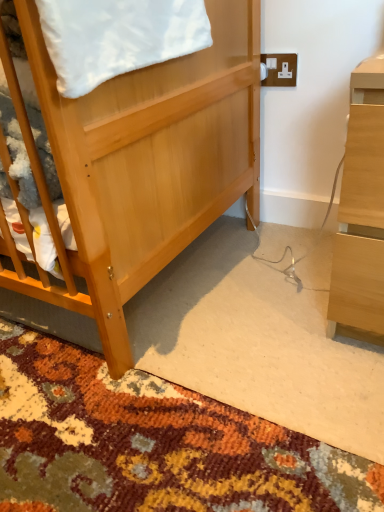
The height and width of the screenshot is (512, 384). I want to click on light brown wooden bed at center, so (x=141, y=164).

At what (x,y) coordinates should I click in order to perform the action: click on carpeted rug at center. Please return your answer as a coordinate pair (x, y). Looking at the image, I should click on (152, 443).

Which object is positioned more to the left, white plastic electric outlet at upper right or light brown wooden bed at center?

light brown wooden bed at center.

Is white plastic electric outlet at upper right wider than light brown wooden bed at center?

No, white plastic electric outlet at upper right is not wider than light brown wooden bed at center.

Can you confirm if white plastic electric outlet at upper right is bigger than light brown wooden bed at center?

Actually, white plastic electric outlet at upper right might be smaller than light brown wooden bed at center.

From a real-world perspective, between white plastic electric outlet at upper right and light brown wooden bed at center, who is vertically higher?

In real-world perspective, white plastic electric outlet at upper right is above.

Does light wood desk at right lie in front of white plastic electric outlet at upper right?

Yes.

Between light wood desk at right and white plastic electric outlet at upper right, which one appears on the left side from the viewer's perspective?

white plastic electric outlet at upper right.

How different are the orientations of light wood desk at right and white plastic electric outlet at upper right in degrees?

The angular difference between light wood desk at right and white plastic electric outlet at upper right is 0.00301 degrees.

Considering the positions of points (351, 281) and (290, 57), is point (351, 281) closer to camera compared to point (290, 57)?

Yes, point (351, 281) is closer to viewer.

Between light brown wooden bed at center and white soft blanket at upper left, which one has larger width?

light brown wooden bed at center is wider.

Is light brown wooden bed at center oriented away from white soft blanket at upper left?

light brown wooden bed at center is not turned away from white soft blanket at upper left.

Is light brown wooden bed at center positioned before white soft blanket at upper left?

Result: No, light brown wooden bed at center is behind white soft blanket at upper left.

Can we say light brown wooden bed at center lies outside white soft blanket at upper left?

That's correct, light brown wooden bed at center is outside of white soft blanket at upper left.

Is there a large distance between light wood desk at right and carpeted rug at center?

No.

Is light wood desk at right taller than carpeted rug at center?

Indeed, light wood desk at right has a greater height compared to carpeted rug at center.

In the scene shown: Considering the relative positions of light wood desk at right and carpeted rug at center in the image provided, is light wood desk at right to the left of carpeted rug at center from the viewer's perspective?

No, light wood desk at right is not to the left of carpeted rug at center.

Which of these two, white plastic electric outlet at upper right or white soft blanket at upper left, stands taller?

white soft blanket at upper left is taller.

From the image's perspective, between white plastic electric outlet at upper right and white soft blanket at upper left, who is located below?

white soft blanket at upper left.

Who is bigger, white plastic electric outlet at upper right or white soft blanket at upper left?

white soft blanket at upper left is bigger.

From a real-world perspective, relative to white soft blanket at upper left, is white plastic electric outlet at upper right vertically above or below?

white plastic electric outlet at upper right is situated lower than white soft blanket at upper left in the real world.

Is light brown wooden bed at center next to white plastic electric outlet at upper right and touching it?

No, light brown wooden bed at center is not with white plastic electric outlet at upper right.

Is light brown wooden bed at center looking in the opposite direction of white plastic electric outlet at upper right?

light brown wooden bed at center does not have its back to white plastic electric outlet at upper right.

Is white plastic electric outlet at upper right inside light brown wooden bed at center?

Definitely not — white plastic electric outlet at upper right is not inside light brown wooden bed at center.

Measure the distance between light brown wooden bed at center and white plastic electric outlet at upper right.

light brown wooden bed at center is 50.00 centimeters away from white plastic electric outlet at upper right.

From a real-world perspective, which is physically above, light wood desk at right or light brown wooden bed at center?

light brown wooden bed at center is physically above.

Find the location of `bed in front of the light wood desk at right`. bed in front of the light wood desk at right is located at coordinates (141, 164).

Is light wood desk at right taller than light brown wooden bed at center?

No, light wood desk at right is not taller than light brown wooden bed at center.

Can you tell me how much light wood desk at right and light brown wooden bed at center differ in facing direction?

0.000222 degrees separate the facing orientations of light wood desk at right and light brown wooden bed at center.

The height and width of the screenshot is (512, 384). Identify the location of bed below the white plastic electric outlet at upper right (from the image's perspective). click(x=141, y=164).

You are a GUI agent. You are given a task and a screenshot of the screen. Output one action in this format:
    pyautogui.click(x=<x>, y=<y>)
    Task: Click on the electric outlet on the left side of light wood desk at right
    This screenshot has width=384, height=512.
    Given the screenshot: What is the action you would take?
    pyautogui.click(x=280, y=69)

Considering their positions, is white plastic electric outlet at upper right positioned further to carpeted rug at center than light brown wooden bed at center?

The object further to carpeted rug at center is white plastic electric outlet at upper right.

Looking at the image, which one is located further to white plastic electric outlet at upper right, light brown wooden bed at center or carpeted rug at center?

carpeted rug at center lies further to white plastic electric outlet at upper right than the other object.

Based on their spatial positions, is carpeted rug at center or light brown wooden bed at center closer to white soft blanket at upper left?

Among the two, light brown wooden bed at center is located nearer to white soft blanket at upper left.

Based on their spatial positions, is carpeted rug at center or white soft blanket at upper left further from white plastic electric outlet at upper right?

carpeted rug at center.

Consider the image. From the image, which object appears to be nearer to white soft blanket at upper left, carpeted rug at center or white plastic electric outlet at upper right?

white plastic electric outlet at upper right is positioned closer to the anchor white soft blanket at upper left.

Looking at the image, which one is located further to white plastic electric outlet at upper right, white soft blanket at upper left or carpeted rug at center?

carpeted rug at center.

Based on their spatial positions, is white soft blanket at upper left or carpeted rug at center closer to light wood desk at right?

white soft blanket at upper left.

Looking at this image, from the image, which object appears to be farther from light wood desk at right, carpeted rug at center or white soft blanket at upper left?

carpeted rug at center lies further to light wood desk at right than the other object.

Find the location of a particular element. desk between white soft blanket at upper left and white plastic electric outlet at upper right along the z-axis is located at coordinates (361, 214).

Where is `electric outlet between light brown wooden bed at center and light wood desk at right in the horizontal direction`? This screenshot has width=384, height=512. electric outlet between light brown wooden bed at center and light wood desk at right in the horizontal direction is located at coordinates (280, 69).

The image size is (384, 512). I want to click on desk located between carpeted rug at center and white plastic electric outlet at upper right in the depth direction, so click(x=361, y=214).

This screenshot has width=384, height=512. What are the coordinates of `mat between light brown wooden bed at center and white plastic electric outlet at upper right in the horizontal direction` in the screenshot? It's located at (152, 443).